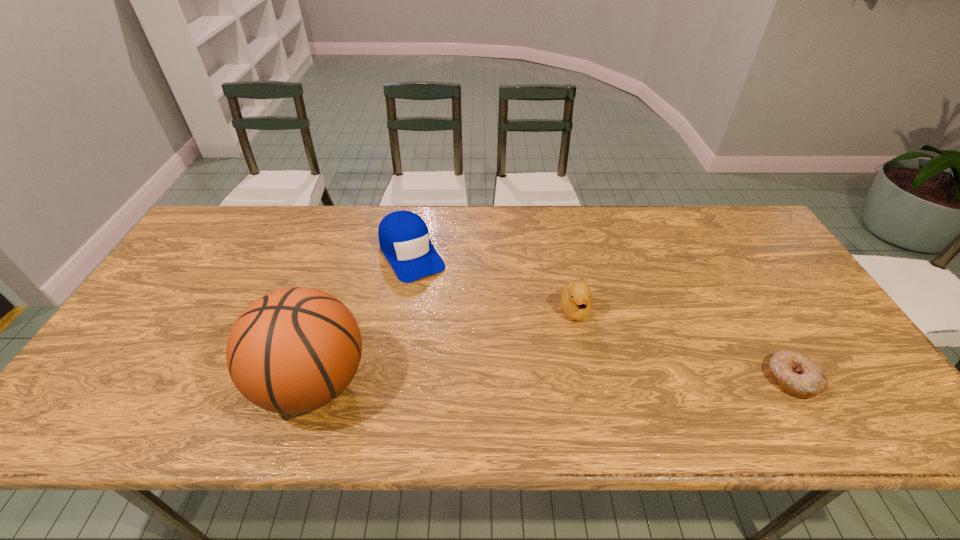
Where is `vacant space on the desktop that is between the basketball and the doughnut and is positioned on the front-facing side of the baseball cap`? The image size is (960, 540). vacant space on the desktop that is between the basketball and the doughnut and is positioned on the front-facing side of the baseball cap is located at coordinates (492, 381).

The image size is (960, 540). I want to click on free spot on the desktop that is between the basketball and the rightmost object and is positioned on the face of the duckling, so click(590, 380).